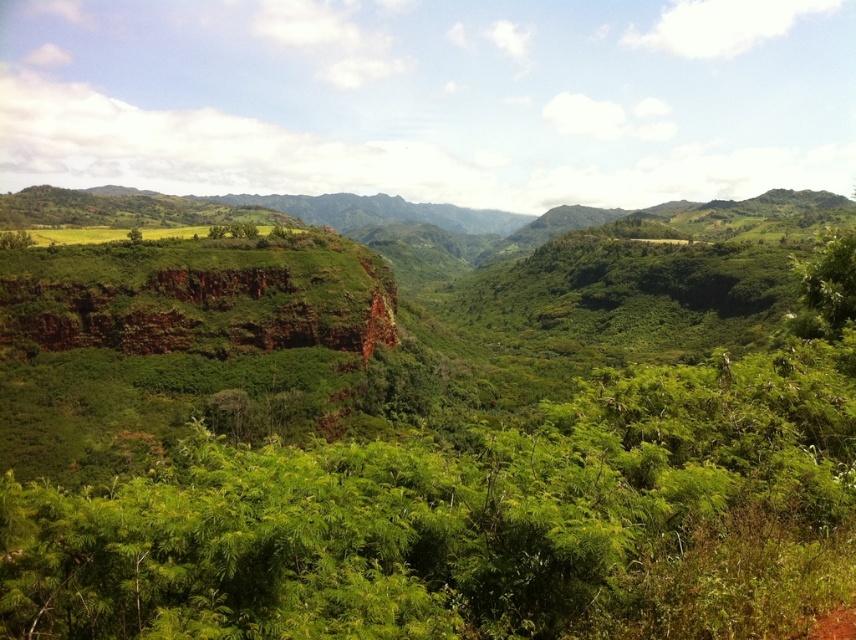
Question: Can you confirm if green leafy shrubs at center is positioned above brown dirt track at lower right?

Choices:
 (A) yes
 (B) no

Answer: (B)

Question: From the image, what is the correct spatial relationship of green leafy shrubs at center in relation to brown dirt track at lower right?

Choices:
 (A) below
 (B) above

Answer: (A)

Question: Observing the image, what is the correct spatial positioning of green leafy shrubs at center in reference to brown dirt track at lower right?

Choices:
 (A) right
 (B) left

Answer: (B)

Question: Which of the following is the farthest from the observer?

Choices:
 (A) brown dirt track at lower right
 (B) green leafy shrubs at center

Answer: (A)

Question: Which point appears closest to the camera in this image?

Choices:
 (A) (837, 627)
 (B) (174, 589)

Answer: (B)